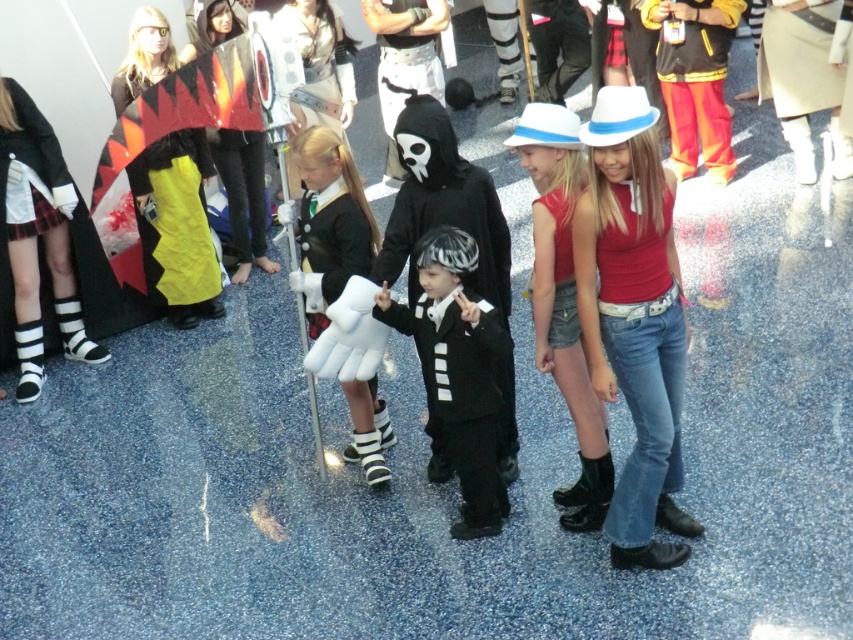
Does point (633, 449) come closer to viewer compared to point (209, 266)?

Yes, point (633, 449) is closer to viewer.

Describe the element at coordinates (642, 360) in the screenshot. The width and height of the screenshot is (853, 640). I see `denim jeans at center` at that location.

Does point (636, 236) come behind point (152, 156)?

No, it is in front of (152, 156).

This screenshot has width=853, height=640. I want to click on denim jeans at center, so click(642, 360).

Can you confirm if matte black suit at center is taller than white matte gloves at center?

Yes, matte black suit at center is taller than white matte gloves at center.

Is matte black suit at center in front of white matte gloves at center?

Yes, it is in front of white matte gloves at center.

Does point (471, 256) come in front of point (316, 316)?

Yes, it is in front of point (316, 316).

In order to click on matte black suit at center in this screenshot , I will do `click(457, 369)`.

Between denim jeans at center and flame-patterned cape at center-left, which one is positioned lower?

denim jeans at center

Is the position of denim jeans at center more distant than that of flame-patterned cape at center-left?

No, it is in front of flame-patterned cape at center-left.

Is point (654, 449) more distant than point (215, 44)?

No, (654, 449) is closer to viewer.

Where is `denim jeans at center`? Image resolution: width=853 pixels, height=640 pixels. denim jeans at center is located at coordinates (642, 360).